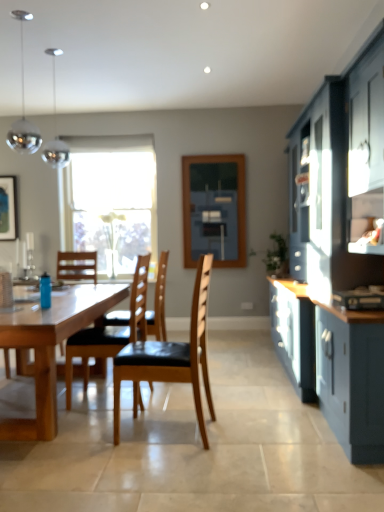
Locate an element on the screen. The image size is (384, 512). free spot in front of blue matte water bottle at table left is located at coordinates (41, 308).